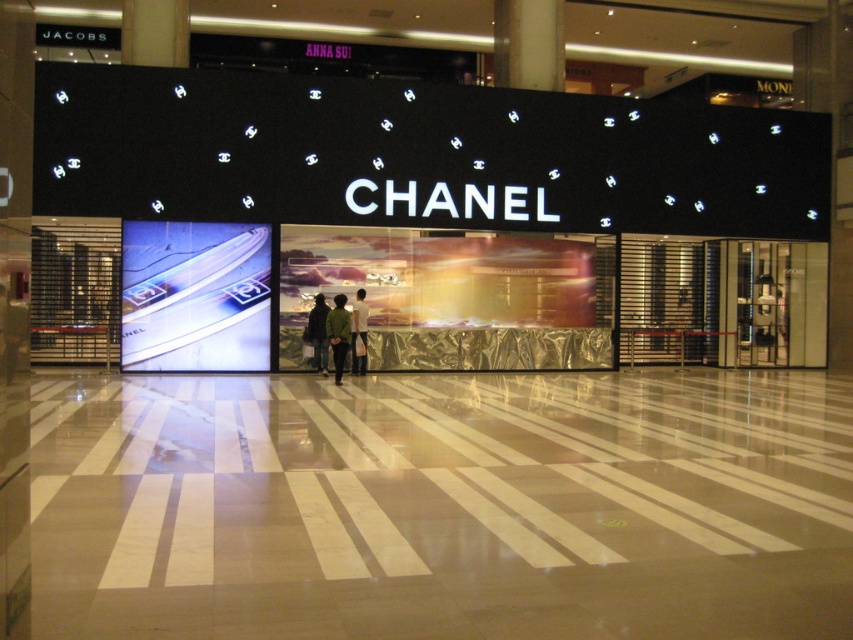
Can you confirm if black leather jacket at center is positioned below white fabric shirt at center?

Indeed, black leather jacket at center is positioned under white fabric shirt at center.

Can you confirm if black leather jacket at center is positioned above white fabric shirt at center?

Incorrect, black leather jacket at center is not positioned above white fabric shirt at center.

What do you see at coordinates (317, 333) in the screenshot? The image size is (853, 640). I see `black leather jacket at center` at bounding box center [317, 333].

In order to click on black leather jacket at center in this screenshot , I will do `click(317, 333)`.

Which is more to the right, green matte jacket at center or white fabric shirt at center?

white fabric shirt at center

Does green matte jacket at center appear over white fabric shirt at center?

No.

Identify the location of green matte jacket at center. (338, 333).

Identify the location of green matte jacket at center. (338, 333).

Between green matte jacket at center and black leather jacket at center, which one is positioned lower?

green matte jacket at center is lower down.

From the picture: Between green matte jacket at center and black leather jacket at center, which one has less height?

With less height is black leather jacket at center.

Where is `green matte jacket at center`? This screenshot has width=853, height=640. green matte jacket at center is located at coordinates (338, 333).

Locate an element on the screen. green matte jacket at center is located at coordinates click(338, 333).